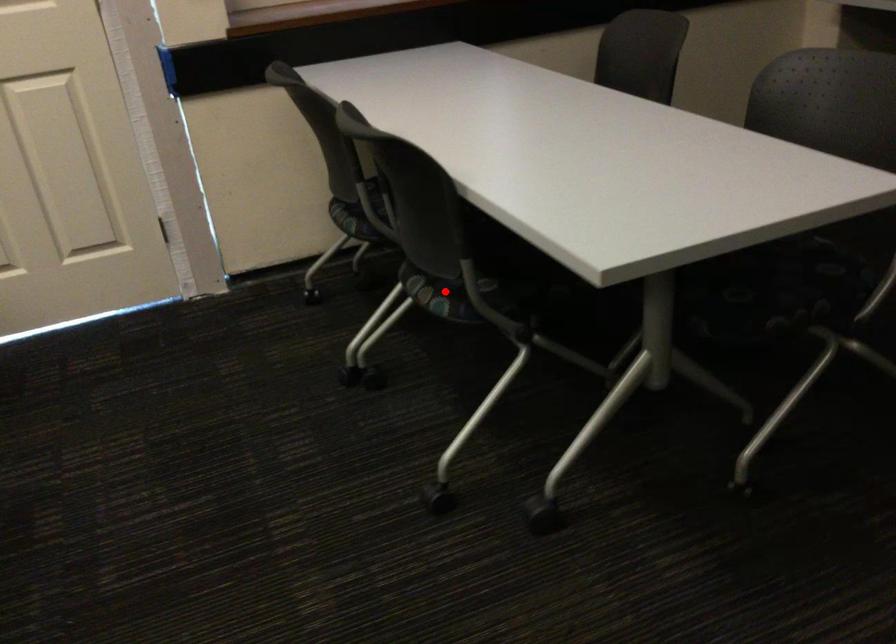
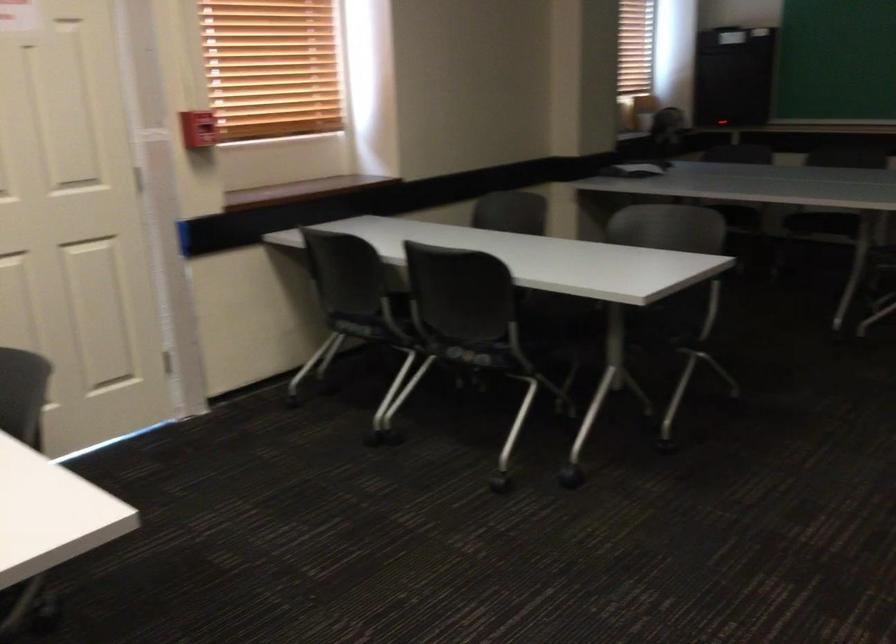
Locate, in the second image, the point that corresponds to the highlighted location in the first image.

(474, 354)